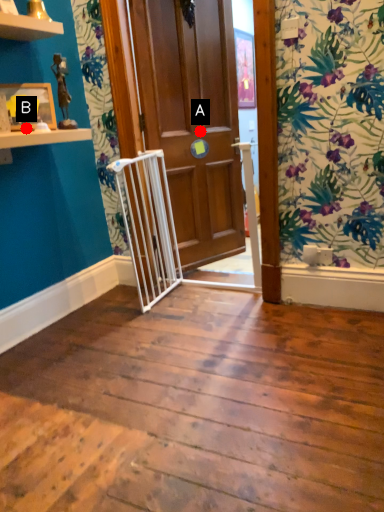
Question: Two points are circled on the image, labeled by A and B beside each circle. Which of the following is the farthest from the observer?

Choices:
 (A) A is further
 (B) B is further

Answer: (A)